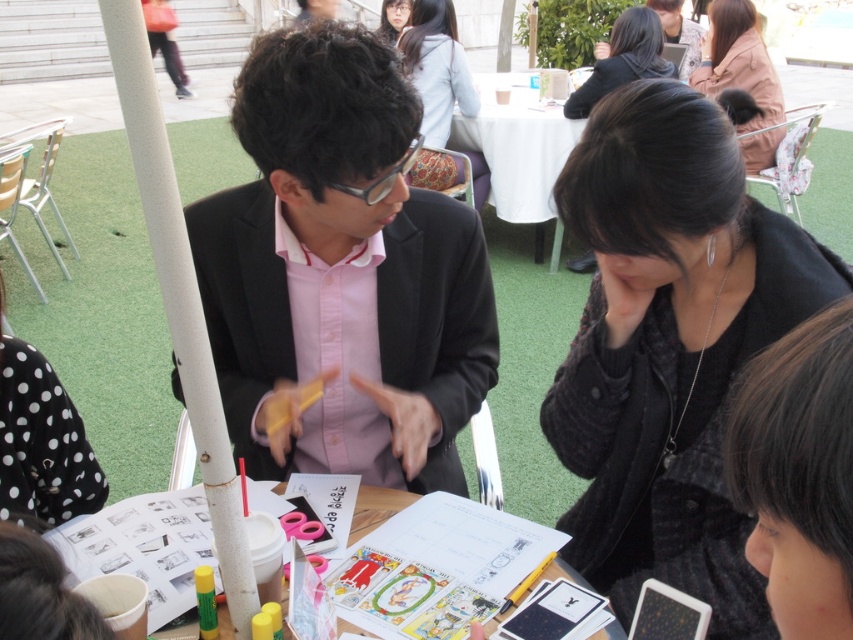
Based on the photo, is matte black suit at center bigger than brown fuzzy coat at upper right?

Actually, matte black suit at center might be smaller than brown fuzzy coat at upper right.

Is point (329, 152) farther from camera compared to point (769, 67)?

No.

You are a GUI agent. You are given a task and a screenshot of the screen. Output one action in this format:
    pyautogui.click(x=<x>, y=<y>)
    Task: Click on the matte black suit at center
    This screenshot has height=640, width=853.
    Given the screenshot: What is the action you would take?
    point(341,273)

Can you confirm if dark brown hair at lower right is shorter than brown fuzzy coat at upper right?

Yes, dark brown hair at lower right is shorter than brown fuzzy coat at upper right.

Where is `dark brown hair at lower right`? dark brown hair at lower right is located at coordinates (798, 472).

Between point (3, 349) and point (389, 0), which one is positioned in front?

Point (3, 349) is more forward.

Does black dotted fabric at lower left have a greater height compared to matte black hair at upper center?

No.

Where is `black dotted fabric at lower left`? The image size is (853, 640). black dotted fabric at lower left is located at coordinates (41, 442).

The height and width of the screenshot is (640, 853). Find the location of `black dotted fabric at lower left`. black dotted fabric at lower left is located at coordinates (41, 442).